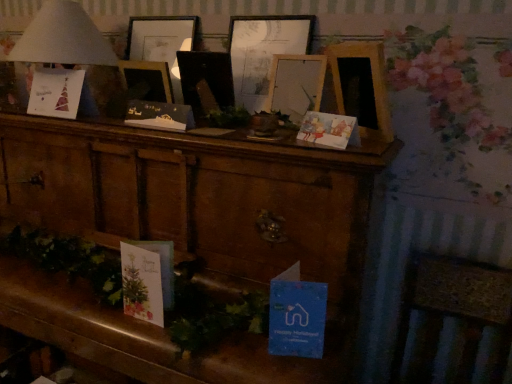
Identify the location of vacant space situated on the left part of matte paper card at center right, placed as the third christmas card when sorted from left to right. The image size is (512, 384). (259, 144).